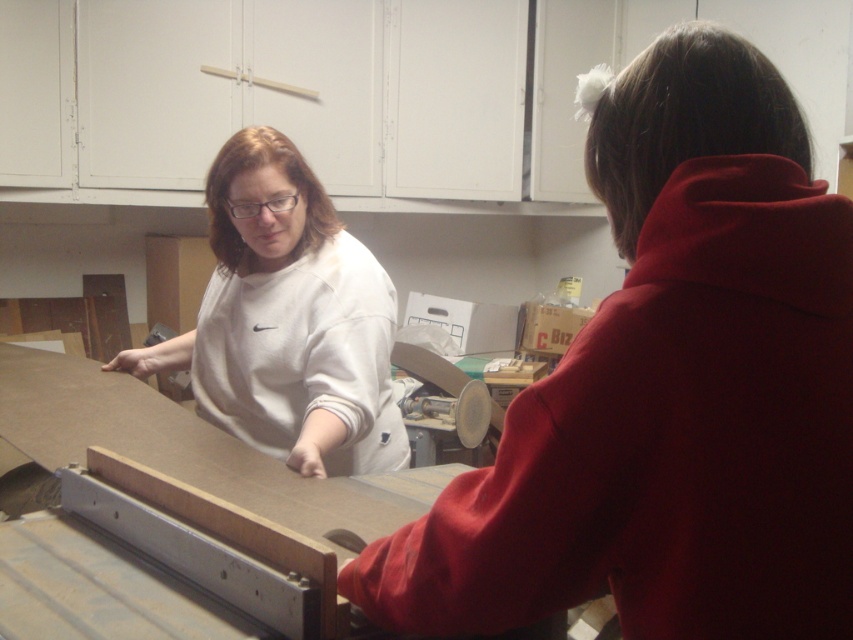
Question: Is white matte sweatshirt at upper left to the left of white matte sweatshirt at center from the viewer's perspective?

Choices:
 (A) yes
 (B) no

Answer: (B)

Question: Which point appears closest to the camera in this image?

Choices:
 (A) (663, 586)
 (B) (271, 308)

Answer: (A)

Question: Does white matte sweatshirt at upper left appear over white matte sweatshirt at center?

Choices:
 (A) yes
 (B) no

Answer: (B)

Question: Which object appears farthest from the camera in this image?

Choices:
 (A) white matte sweatshirt at center
 (B) white matte sweatshirt at upper left

Answer: (A)

Question: Does white matte sweatshirt at upper left appear under white matte sweatshirt at center?

Choices:
 (A) no
 (B) yes

Answer: (B)